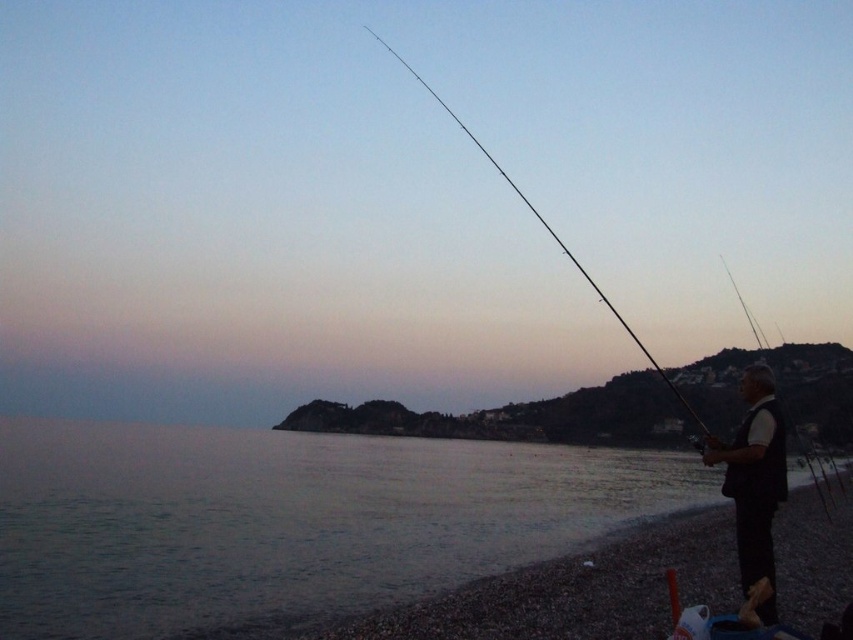
Between black fabric vest at lower right and smooth black rod at right, which one has more height?

smooth black rod at right is taller.

Which is below, black fabric vest at lower right or smooth black rod at right?

black fabric vest at lower right is lower down.

Does point (766, 371) lie behind point (720, 262)?

No, (766, 371) is closer to viewer.

The image size is (853, 640). I want to click on black fabric vest at lower right, so click(753, 483).

Can you confirm if black rod fishing pole at center is taller than smooth black rod at right?

Correct, black rod fishing pole at center is much taller as smooth black rod at right.

Locate an element on the screen. The image size is (853, 640). black rod fishing pole at center is located at coordinates (547, 232).

Identify the location of black rod fishing pole at center. (547, 232).

Can you confirm if clear water at lower left is positioned above smooth black rod at right?

Incorrect, clear water at lower left is not positioned above smooth black rod at right.

Between clear water at lower left and smooth black rod at right, which one has more height?

Standing taller between the two is smooth black rod at right.

Is point (299, 461) closer to camera compared to point (756, 340)?

That is True.

Where is `clear water at lower left`? Image resolution: width=853 pixels, height=640 pixels. clear water at lower left is located at coordinates (288, 522).